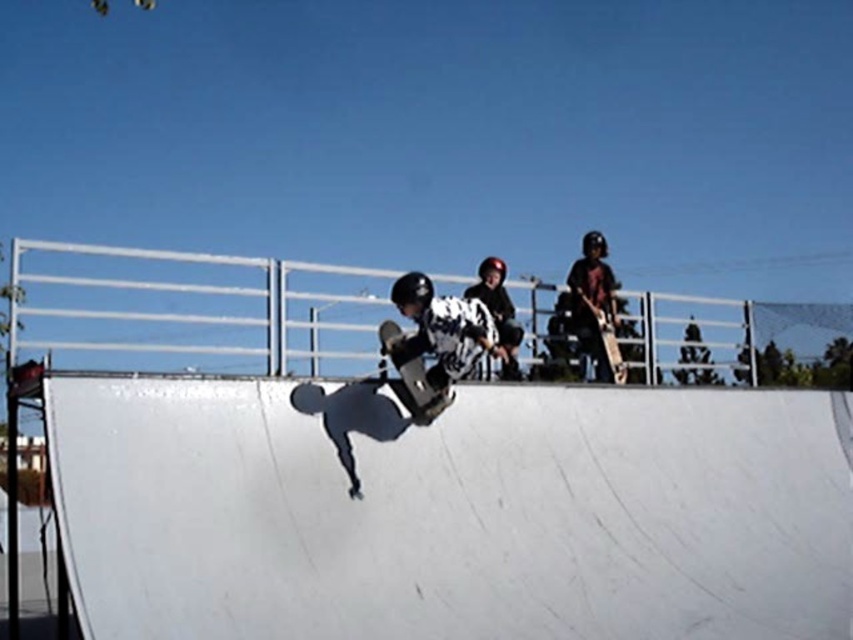
You are a skateboarder at the skatepark and want to place your dark gray helmet at upper right on the white smooth ramp at center. Is the ramp to the left or right of the helmet?

The white smooth ramp at center is to the left of dark gray helmet at upper right, so the ramp is on the left side relative to the helmet.

You are a safety inspector at the skatepark. You need to ensure there is enough space between the white smooth ramp at center and the black matte skateboard at center for the skateboarder to land safely. The minimum required distance for safe landing is 1.5 meters. Is the current distance sufficient?

The white smooth ramp at center is 1.67 meters away from the black matte skateboard at center, which exceeds the minimum required distance of 1.5 meters. Therefore, the current distance is sufficient for a safe landing.

You are a skateboarder at the skatepark. You want to place your black matte skateboard at center on the white smooth ramp at center. Based on their positions, can you tell if the ramp is to the left or right of your skateboard?

The white smooth ramp at center is to the right of the black matte skateboard at center, so the ramp is positioned to the right side of the skateboard.